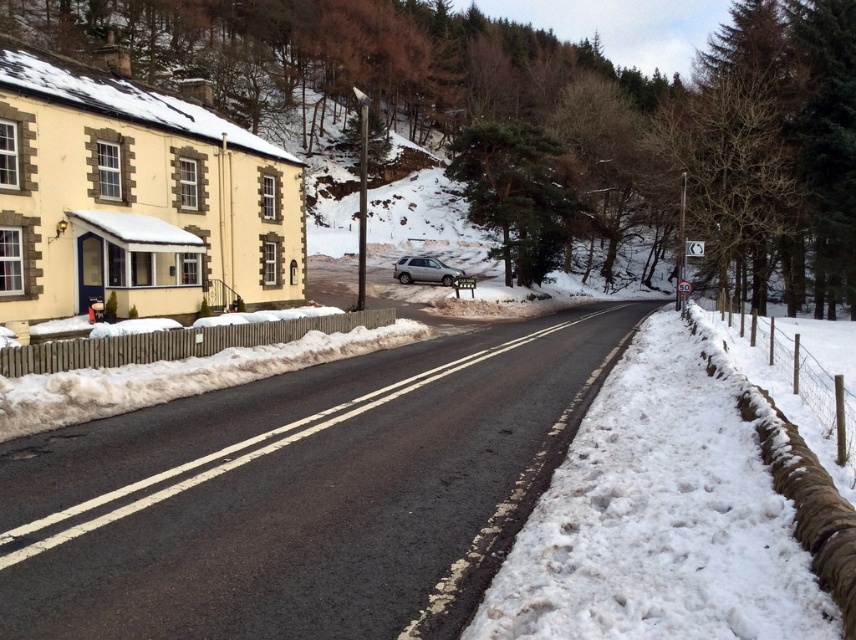
Question: In this image, where is white fluffy snow at road right located relative to satin silver suv at center?

Choices:
 (A) below
 (B) above

Answer: (A)

Question: Which of the following is the closest to the observer?

Choices:
 (A) (603, 621)
 (B) (437, 259)

Answer: (A)

Question: Can you confirm if white fluffy snow at road right is bigger than satin silver suv at center?

Choices:
 (A) yes
 (B) no

Answer: (B)

Question: Can you confirm if white fluffy snow at road right is positioned to the right of satin silver suv at center?

Choices:
 (A) no
 (B) yes

Answer: (B)

Question: Which object appears farthest from the camera in this image?

Choices:
 (A) white fluffy snow at road right
 (B) satin silver suv at center

Answer: (B)